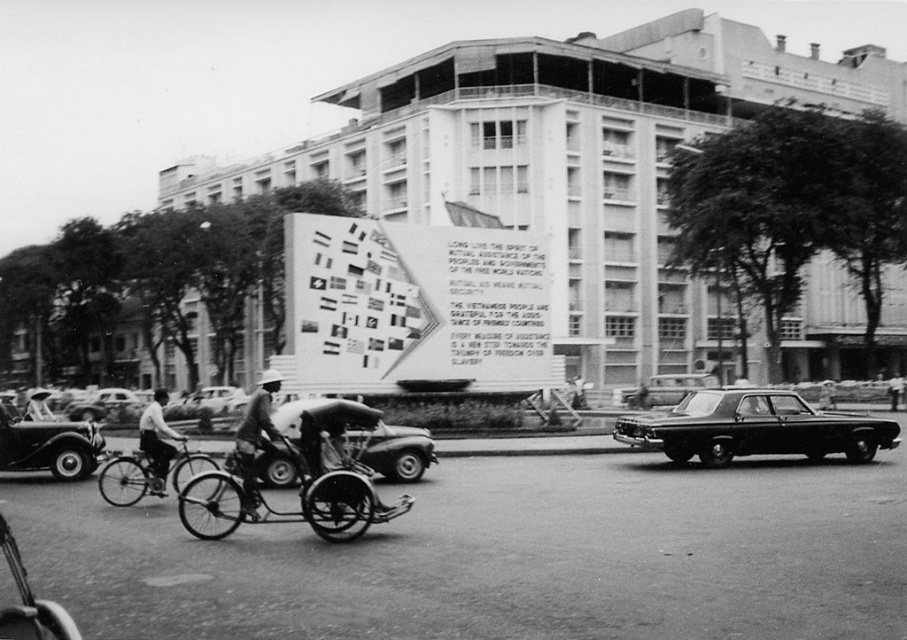
Based on the photo, you are a photographer standing in the middle of the street. You want to take a photo of the monument with both the shiny black sedan at right and the shiny black car at left in the frame. Which car should you position closer to the monument to ensure both vehicles are visible in the photo?

The shiny black car at left should be positioned closer to the monument because the shiny black sedan at right is already on the right side of it, so moving the left car closer would help frame both vehicles within the photo.

You are a photographer standing in the middle of the street. You want to take a photo of the metallic silver car at center and the dark gray fabric hat at center. Which object is wider?

The metallic silver car at center is narrower than the dark gray fabric hat at center because its width is less than that of the dark gray fabric hat at center.